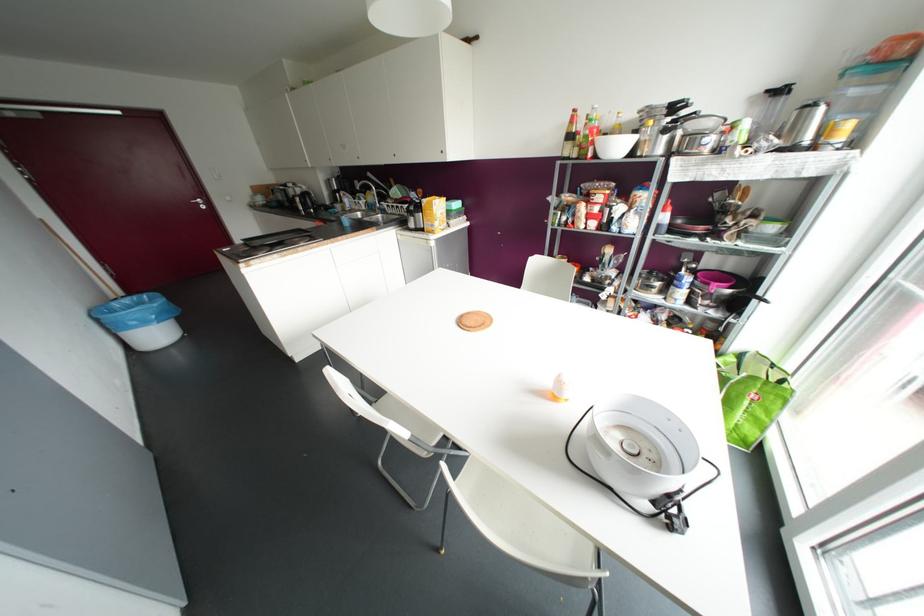
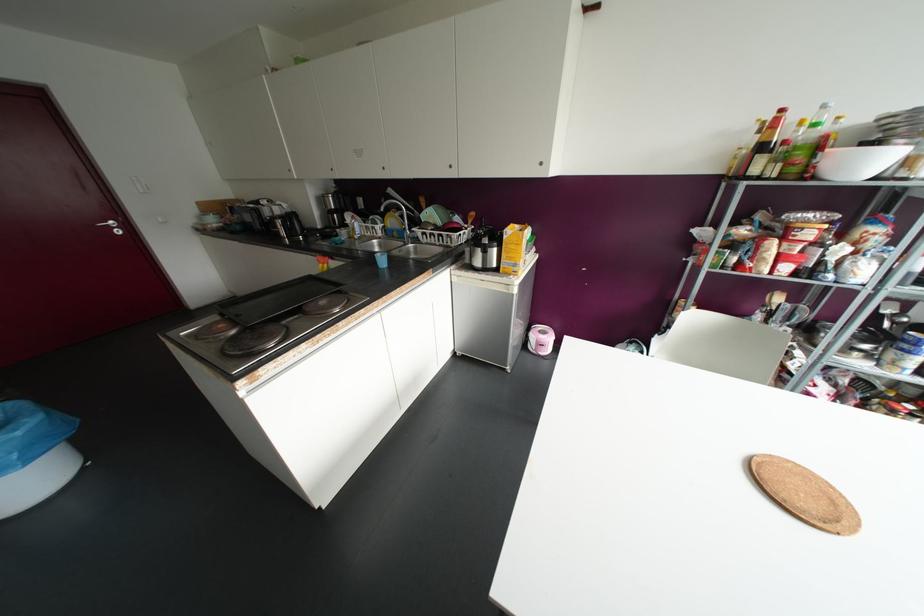
Find the pixel in the second image that matches (x=574, y=110) in the first image.

(781, 110)